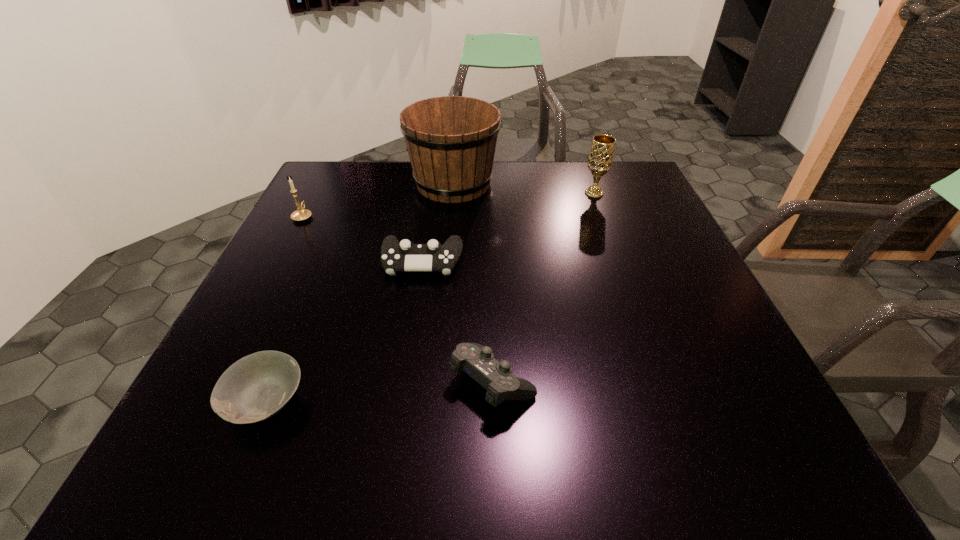
This screenshot has height=540, width=960. Find the location of `candle holder at the left edge`. candle holder at the left edge is located at coordinates (301, 214).

This screenshot has height=540, width=960. Find the location of `bowl that is at the left edge`. bowl that is at the left edge is located at coordinates (256, 387).

The height and width of the screenshot is (540, 960). In order to click on object present at the right edge in this screenshot , I will do `click(600, 159)`.

Locate an element on the screen. This screenshot has height=540, width=960. object present at the near left corner is located at coordinates (256, 387).

In order to click on object present at the far right corner in this screenshot , I will do `click(600, 159)`.

What are the coordinates of `free spot at the far edge of the desktop` in the screenshot? It's located at (544, 192).

You are a GUI agent. You are given a task and a screenshot of the screen. Output one action in this format:
    pyautogui.click(x=<x>, y=<y>)
    Task: Click on the free spot at the left edge of the desktop
    
    Given the screenshot: What is the action you would take?
    pyautogui.click(x=320, y=281)

This screenshot has height=540, width=960. What are the coordinates of `vacant position at the right edge of the desktop` in the screenshot? It's located at (704, 400).

The width and height of the screenshot is (960, 540). What are the coordinates of `vacant position at the far right corner of the desktop` in the screenshot? It's located at (620, 179).

At what (x,y) coordinates should I click in order to perform the action: click on free space between the nearer control and the rightmost object. Please return your answer as a coordinate pair (x, y). Looking at the image, I should click on (543, 288).